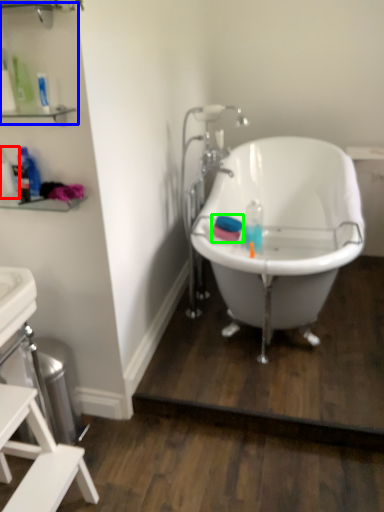
Question: Estimate the real-world distances between objects in this image. Which object is farther from bottle (highlighted by a red box), shelf (highlighted by a blue box) or mouthwash (highlighted by a green box)?

Choices:
 (A) shelf
 (B) mouthwash

Answer: (B)